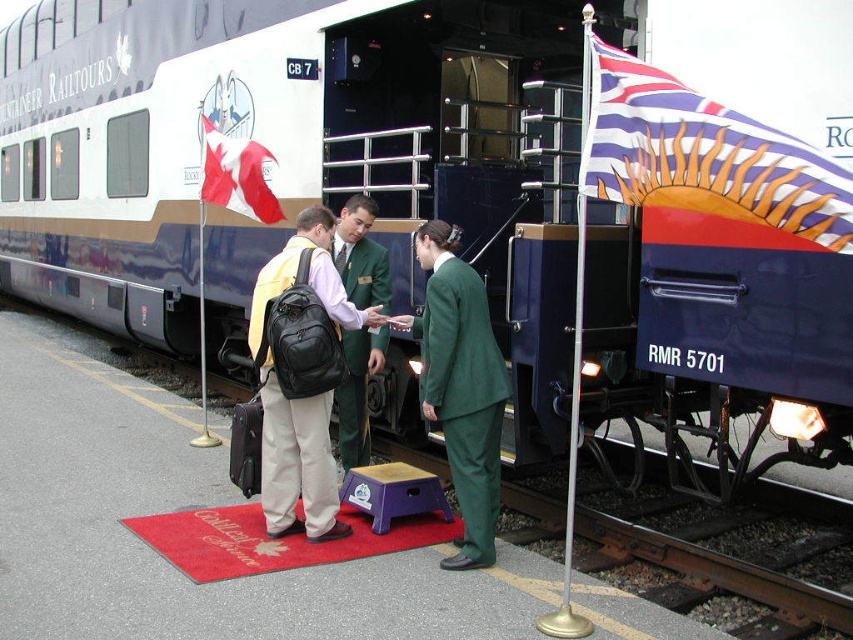
You are a passenger at the train station and see a matte black backpack at center and a green fabric uniform at center. Which item is closer to the ground?

The matte black backpack at center is closer to the ground because it is located below the green fabric uniform at center.